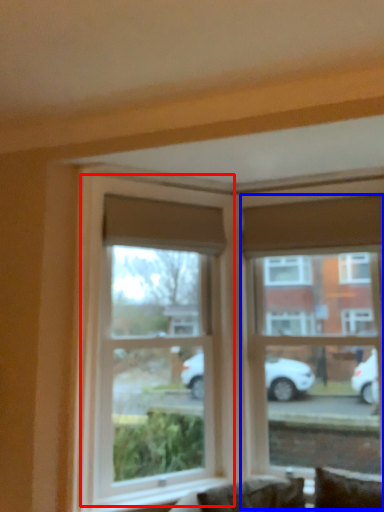
Question: Which point is further to the camera, window (highlighted by a red box) or window (highlighted by a blue box)?

Choices:
 (A) window
 (B) window

Answer: (B)